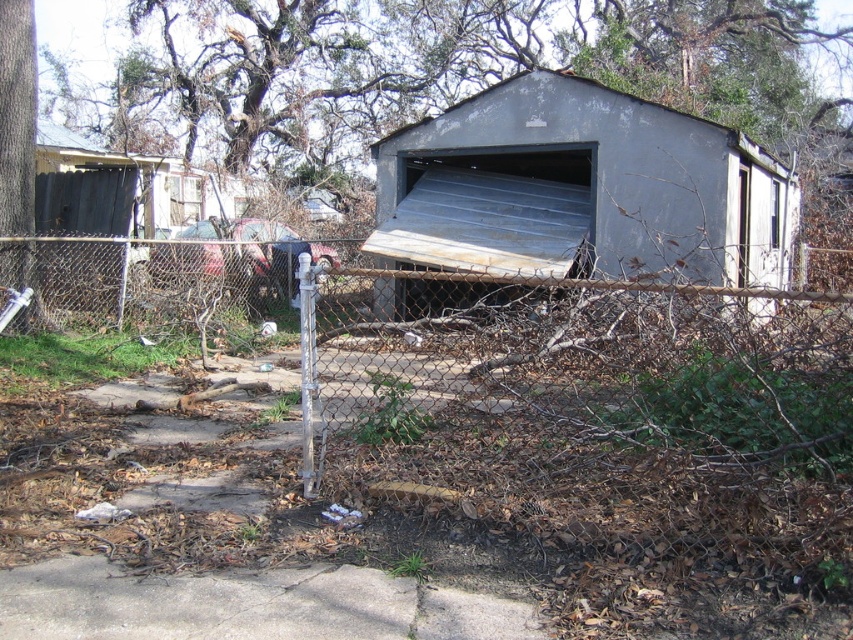
Question: Can you confirm if rusty metal shed at center is wider than rusty metal garage door at center?

Choices:
 (A) no
 (B) yes

Answer: (A)

Question: Does rusty metal shed at center appear over rusty metal garage door at center?

Choices:
 (A) no
 (B) yes

Answer: (B)

Question: Is rusty metal shed at center closer to camera compared to rusty metal garage door at center?

Choices:
 (A) yes
 (B) no

Answer: (B)

Question: Among these points, which one is nearest to the camera?

Choices:
 (A) (575, 184)
 (B) (392, 314)

Answer: (B)

Question: Which object is closer to the camera taking this photo?

Choices:
 (A) rusty metal garage door at center
 (B) rusty metal shed at center

Answer: (A)